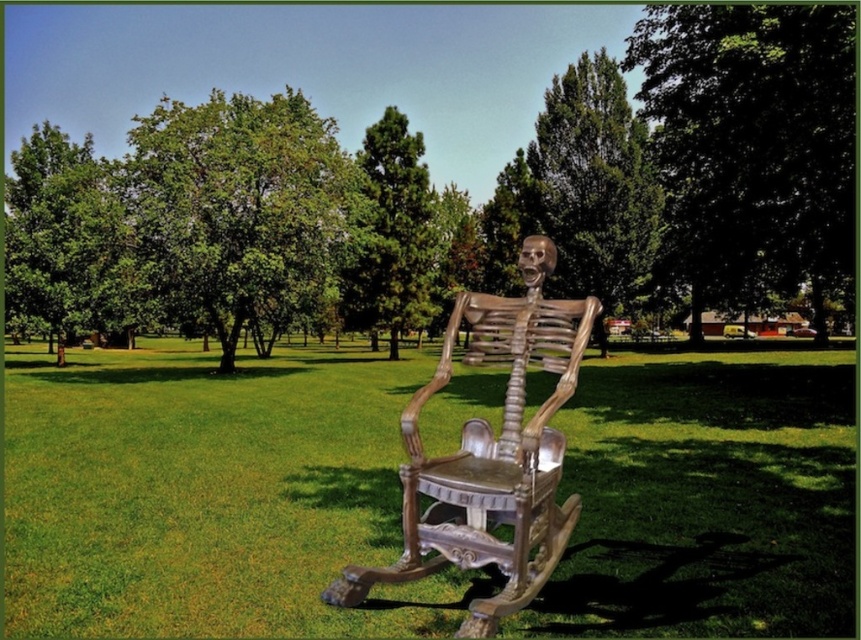
Does green grass at center have a lesser height compared to wooden rocking chair at center?

Yes.

The height and width of the screenshot is (640, 861). Describe the element at coordinates (209, 496) in the screenshot. I see `green grass at center` at that location.

Find the location of a particular element. green grass at center is located at coordinates (209, 496).